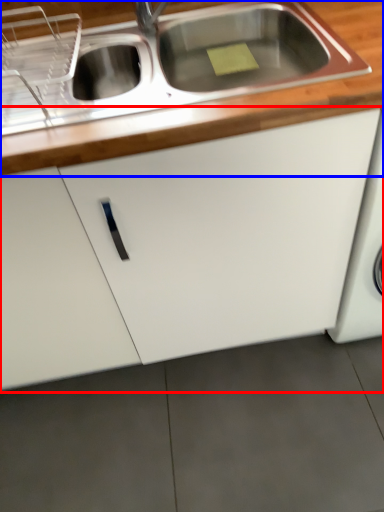
Question: Which object is closer to the camera taking this photo, cabinetry (highlighted by a red box) or countertop (highlighted by a blue box)?

Choices:
 (A) cabinetry
 (B) countertop

Answer: (B)